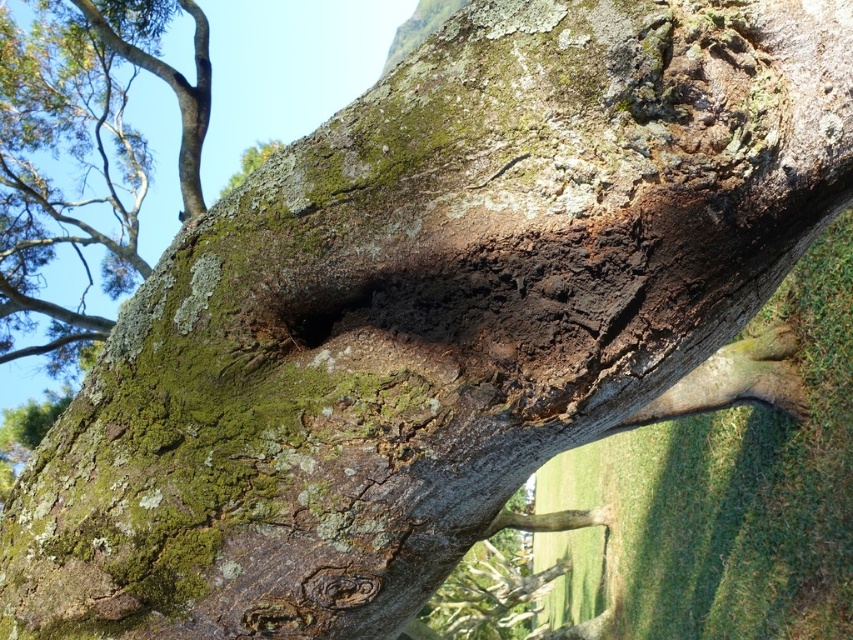
Question: Which point is farther to the camera?

Choices:
 (A) dark brown rough hole at center
 (B) green mossy bark at upper left

Answer: (B)

Question: Is green mossy bark at upper left to the left of dark brown rough hole at center from the viewer's perspective?

Choices:
 (A) no
 (B) yes

Answer: (B)

Question: Is green mossy bark at upper left to the left of dark brown rough hole at center from the viewer's perspective?

Choices:
 (A) no
 (B) yes

Answer: (B)

Question: Which point is closer to the camera?

Choices:
 (A) green mossy bark at upper left
 (B) dark brown rough hole at center

Answer: (B)

Question: Which object appears closest to the camera in this image?

Choices:
 (A) green mossy bark at upper left
 (B) dark brown rough hole at center

Answer: (B)

Question: Can you confirm if green mossy bark at upper left is wider than dark brown rough hole at center?

Choices:
 (A) yes
 (B) no

Answer: (A)